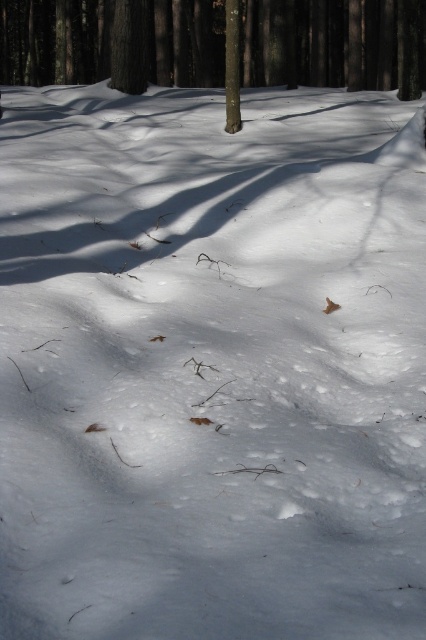
You are an animal looking for a hiding spot in the forest. Which of the two trees, the brown rough tree at center or the smooth brown tree trunk at center, would provide better coverage due to its size?

The brown rough tree at center is larger in size than the smooth brown tree trunk at center, so it would provide better coverage for hiding.